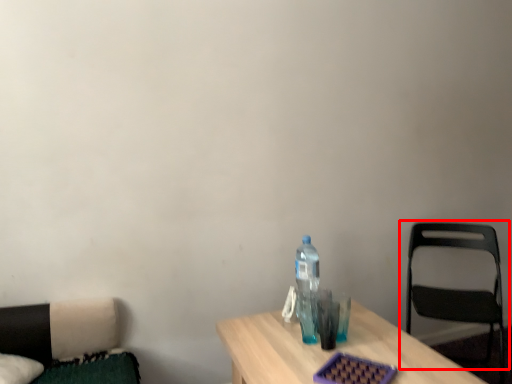
Question: From the image's perspective, considering the relative positions of chair (annotated by the red box) and bottle in the image provided, where is chair (annotated by the red box) located with respect to the staircase?

Choices:
 (A) below
 (B) above

Answer: (A)